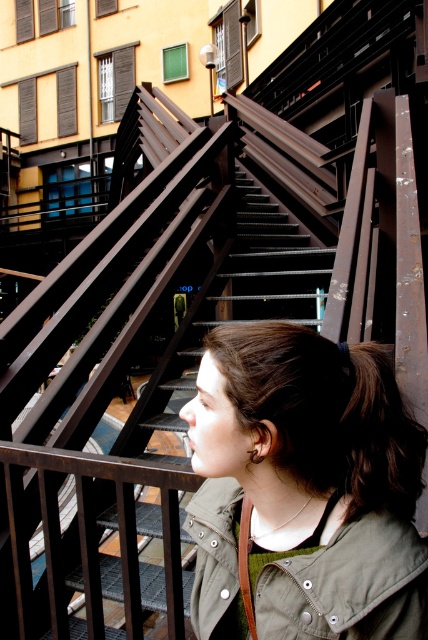
Question: Is matte olive green jacket at lower right bigger than brown matte hair at lower right?

Choices:
 (A) no
 (B) yes

Answer: (B)

Question: In this image, where is matte olive green jacket at lower right located relative to brown matte hair at lower right?

Choices:
 (A) below
 (B) above

Answer: (A)

Question: Is matte olive green jacket at lower right thinner than brown matte hair at lower right?

Choices:
 (A) yes
 (B) no

Answer: (B)